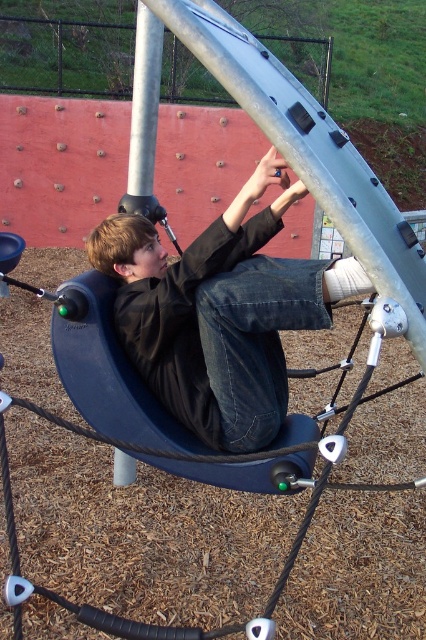
Who is higher up, matte black jacket at center or silver metallic pole at upper center?

silver metallic pole at upper center is higher up.

Can you confirm if matte black jacket at center is thinner than silver metallic pole at upper center?

Incorrect, matte black jacket at center's width is not less than silver metallic pole at upper center's.

I want to click on matte black jacket at center, so [x=219, y=310].